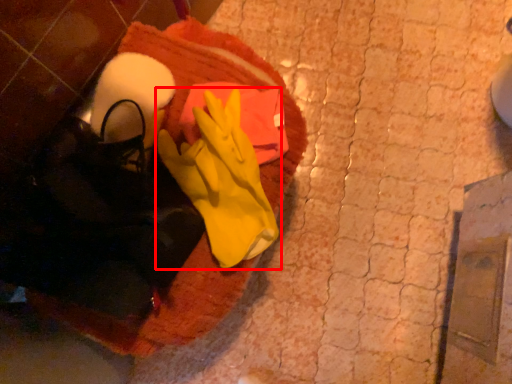
Question: Observing the image, what is the correct spatial positioning of glove (annotated by the red box) in reference to blanket?

Choices:
 (A) right
 (B) left

Answer: (A)